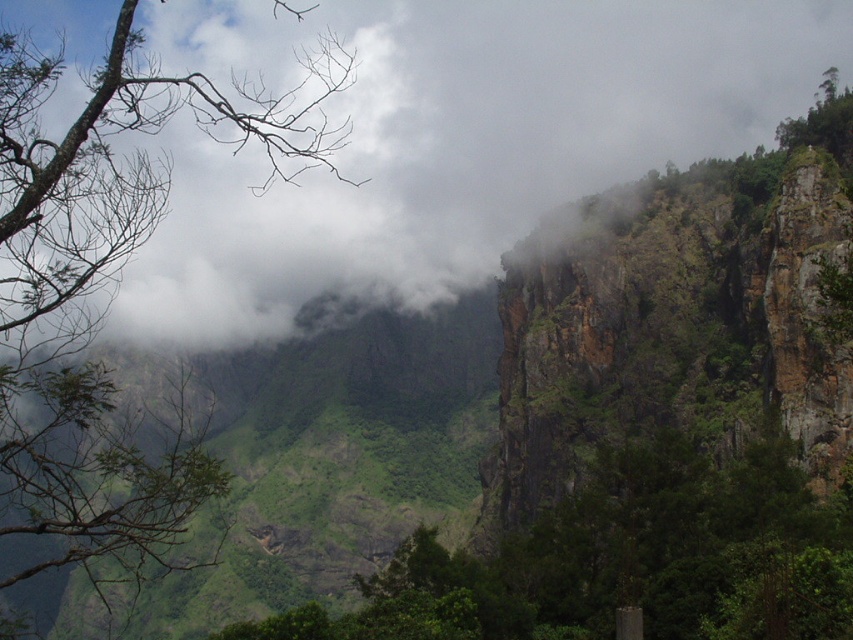
You are an artist painting this landscape. You want to ensure the white fluffy cloud at upper left and the green leafy tree at center are proportionally accurate. Which object should you make bigger in your painting?

The white fluffy cloud at upper left should be made bigger than the green leafy tree at center because it is larger in size according to the description.

Consider the image. You are an environmental scientist analyzing this landscape. You need to determine which tree has a wider canopy based on their positions. Which tree has a larger width between the green leafy tree at upper left and the green leafy tree at center?

The green leafy tree at upper left has a larger width than the green leafy tree at center.